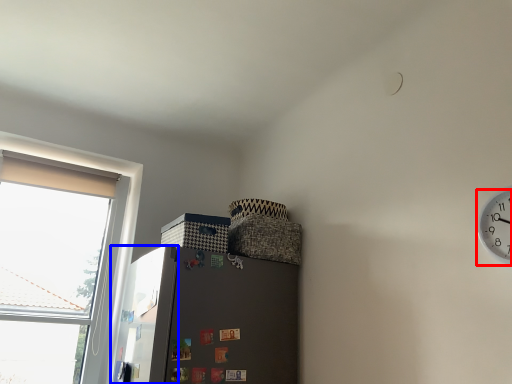
Question: Which of the following is the farthest to the observer, clock (highlighted by a red box) or screen door (highlighted by a blue box)?

Choices:
 (A) clock
 (B) screen door

Answer: (B)